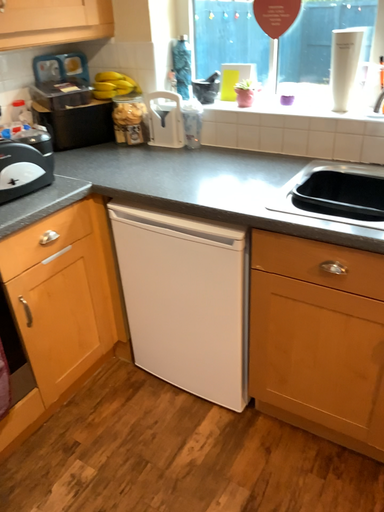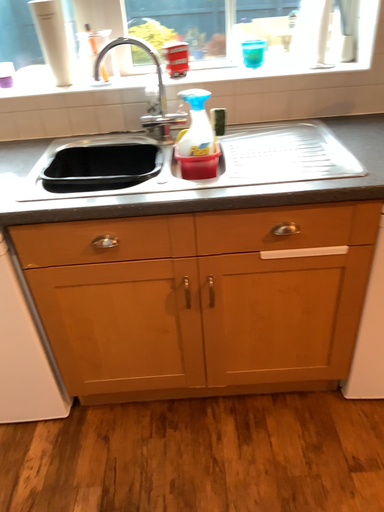
Question: How did the camera likely rotate when shooting the video?

Choices:
 (A) rotated right
 (B) rotated left

Answer: (A)